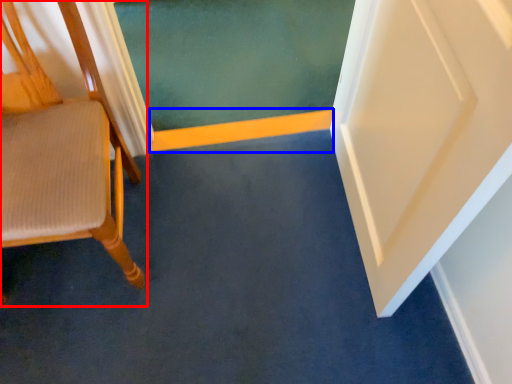
Question: Which object is closer to the camera taking this photo, chair (highlighted by a red box) or strip (highlighted by a blue box)?

Choices:
 (A) chair
 (B) strip

Answer: (A)